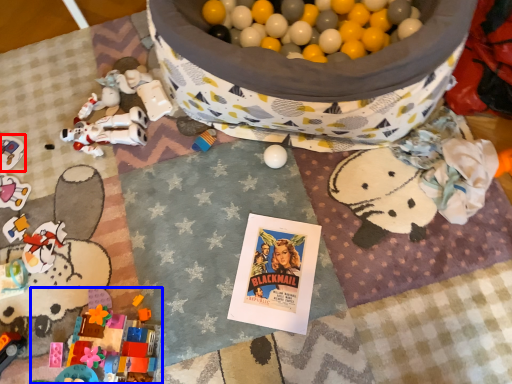
Question: Which point is further to the camera, toy (highlighted by a red box) or toy (highlighted by a blue box)?

Choices:
 (A) toy
 (B) toy

Answer: (A)